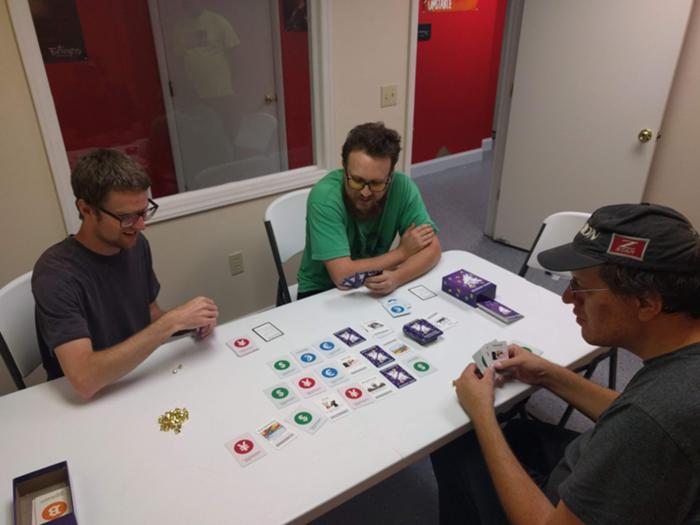
This screenshot has height=525, width=700. Find the location of `door`. door is located at coordinates (225, 87), (564, 61).